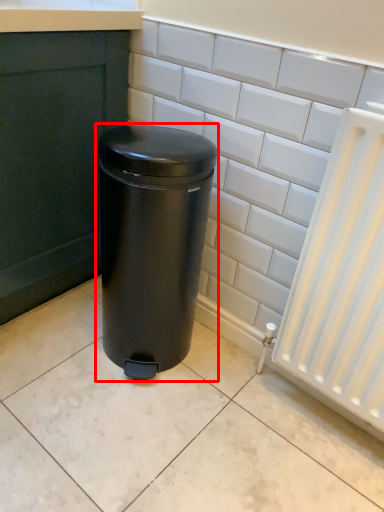
Question: In this image, where is waste container (annotated by the red box) located relative to ceramic tile?

Choices:
 (A) right
 (B) left

Answer: (B)